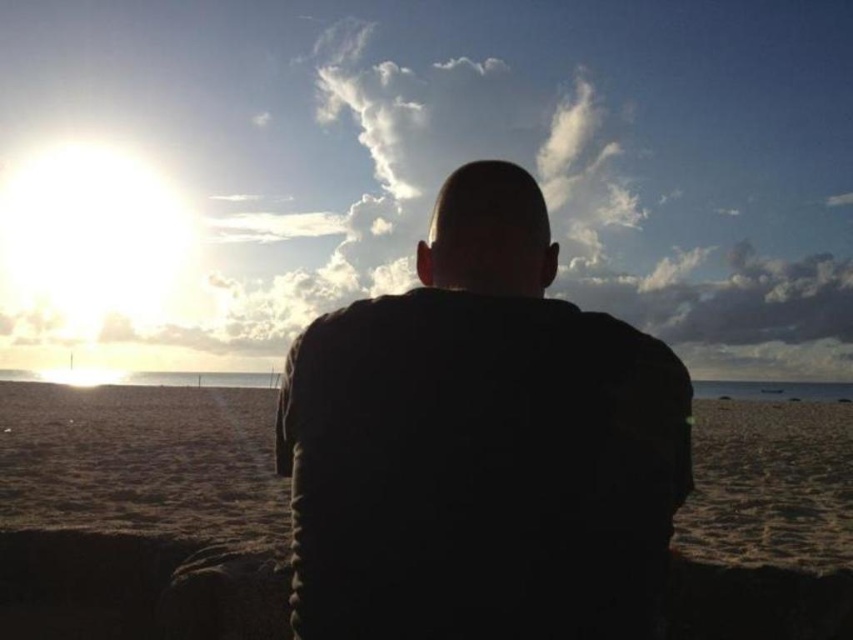
Does black matte jacket at center come behind sandy beach at center?

No, it is in front of sandy beach at center.

Which is above, black matte jacket at center or sandy beach at center?

black matte jacket at center

Who is more forward, (384,506) or (123,429)?

Positioned in front is point (384,506).

Where is `black matte jacket at center`? The image size is (853, 640). black matte jacket at center is located at coordinates (480, 444).